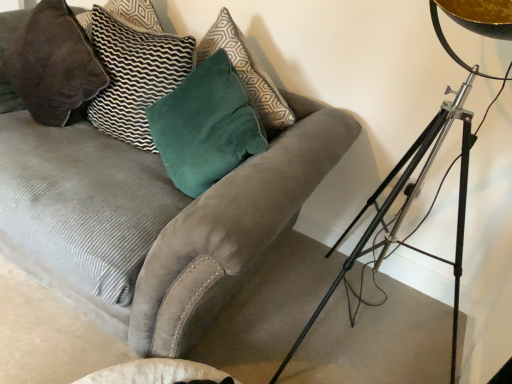
At what (x,y) coordinates should I click in order to perform the action: click on free point below metallic tripod at right (from a real-world perspective). Please return your answer as a coordinate pair (x, y). Looking at the image, I should click on (329, 330).